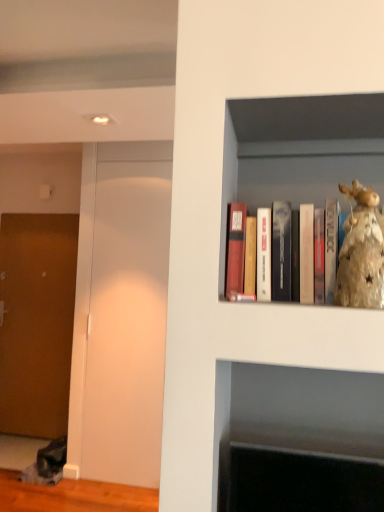
Question: Considering the relative sizes of matte wooden books at upper right and shiny gold figurine at upper right in the image provided, is matte wooden books at upper right smaller than shiny gold figurine at upper right?

Choices:
 (A) yes
 (B) no

Answer: (B)

Question: From the image's perspective, is matte wooden books at upper right over shiny gold figurine at upper right?

Choices:
 (A) yes
 (B) no

Answer: (A)

Question: Is matte wooden books at upper right outside shiny gold figurine at upper right?

Choices:
 (A) no
 (B) yes

Answer: (B)

Question: Considering the relative sizes of matte wooden books at upper right and shiny gold figurine at upper right in the image provided, is matte wooden books at upper right bigger than shiny gold figurine at upper right?

Choices:
 (A) no
 (B) yes

Answer: (B)

Question: Is there a large distance between matte wooden books at upper right and shiny gold figurine at upper right?

Choices:
 (A) no
 (B) yes

Answer: (A)

Question: Is matte wooden books at upper right taller than shiny gold figurine at upper right?

Choices:
 (A) no
 (B) yes

Answer: (B)

Question: Is brown textured door at left to the left of matte wooden books at upper right from the viewer's perspective?

Choices:
 (A) no
 (B) yes

Answer: (B)

Question: From the image's perspective, is brown textured door at left under matte wooden books at upper right?

Choices:
 (A) yes
 (B) no

Answer: (A)

Question: Considering the relative positions of brown textured door at left and matte wooden books at upper right in the image provided, is brown textured door at left to the right of matte wooden books at upper right from the viewer's perspective?

Choices:
 (A) yes
 (B) no

Answer: (B)

Question: Is brown textured door at left next to matte wooden books at upper right and touching it?

Choices:
 (A) yes
 (B) no

Answer: (B)

Question: Is brown textured door at left bigger than matte wooden books at upper right?

Choices:
 (A) no
 (B) yes

Answer: (B)

Question: Can you confirm if brown textured door at left is taller than matte wooden books at upper right?

Choices:
 (A) no
 (B) yes

Answer: (B)

Question: Does shiny gold figurine at upper right appear on the left side of transparent glass door at left?

Choices:
 (A) no
 (B) yes

Answer: (A)